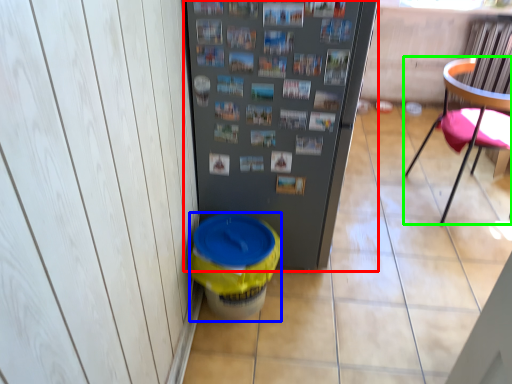
Question: Which object is positioned closest to refrigerator (highlighted by a red box)? Select from potty (highlighted by a blue box) and chair (highlighted by a green box).

Choices:
 (A) potty
 (B) chair

Answer: (A)